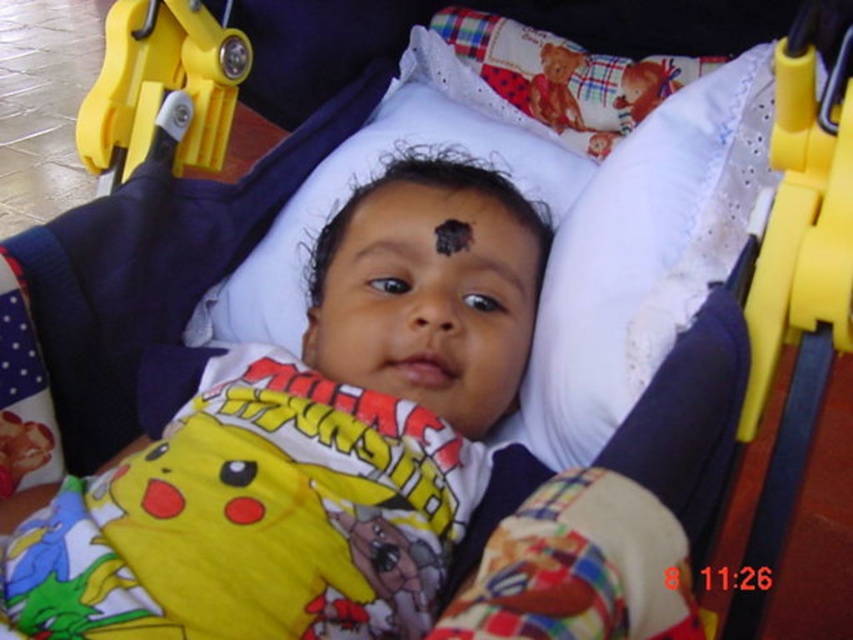
Question: Can you confirm if yellow plastic stroller at right is wider than yellow plastic buckle at upper left?

Choices:
 (A) yes
 (B) no

Answer: (B)

Question: Which point is farther to the camera?

Choices:
 (A) black matte mark at center
 (B) yellow plastic stroller at right
 (C) yellow cotton shirt at center
 (D) white lace pillow at upper center

Answer: (A)

Question: Which of these objects is positioned farthest from the white lace pillow at upper center?

Choices:
 (A) yellow cotton shirt at center
 (B) black matte mark at center
 (C) yellow plastic stroller at right

Answer: (A)

Question: Is white lace pillow at upper center to the right of black matte mark at center from the viewer's perspective?

Choices:
 (A) yes
 (B) no

Answer: (A)

Question: Which object is positioned closest to the yellow plastic buckle at upper left?

Choices:
 (A) white lace pillow at upper center
 (B) black matte mark at center
 (C) yellow cotton shirt at center

Answer: (B)

Question: Considering the relative positions of white lace pillow at upper center and black matte mark at center in the image provided, where is white lace pillow at upper center located with respect to black matte mark at center?

Choices:
 (A) right
 (B) left

Answer: (A)